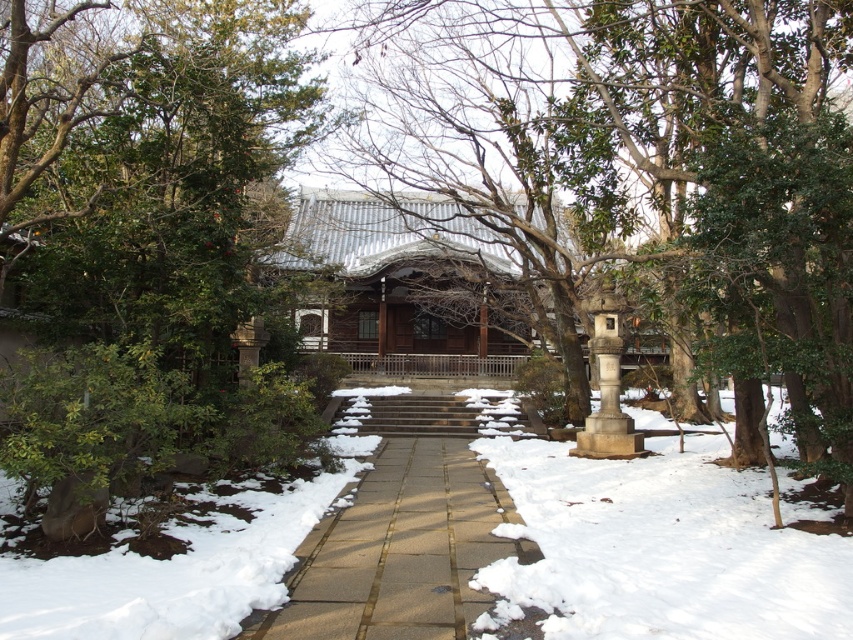
Who is positioned more to the right, green leafy tree at left or gray stone lantern at center?

Positioned to the right is gray stone lantern at center.

Between green leafy tree at left and gray stone lantern at center, which one has more height?

With more height is green leafy tree at left.

You are a GUI agent. You are given a task and a screenshot of the screen. Output one action in this format:
    pyautogui.click(x=<x>, y=<y>)
    Task: Click on the green leafy tree at left
    
    Given the screenshot: What is the action you would take?
    coord(151,170)

Is point (105, 268) in front of point (444, 225)?

Yes, point (105, 268) is in front of point (444, 225).

Who is more distant from viewer, (x=141, y=188) or (x=397, y=353)?

Positioned behind is point (x=397, y=353).

Is point (22, 150) positioned after point (315, 320)?

No, it is in front of (315, 320).

Image resolution: width=853 pixels, height=640 pixels. In order to click on green leafy tree at left in this screenshot , I will do `click(151, 170)`.

Which is behind, point (180, 109) or point (450, 618)?

Positioned behind is point (180, 109).

Is green leafy tree at left above smooth stone pathway at center?

Correct, green leafy tree at left is located above smooth stone pathway at center.

Is point (96, 81) farther from viewer compared to point (380, 584)?

Yes, point (96, 81) is behind point (380, 584).

Identify the location of green leafy tree at left. (151, 170).